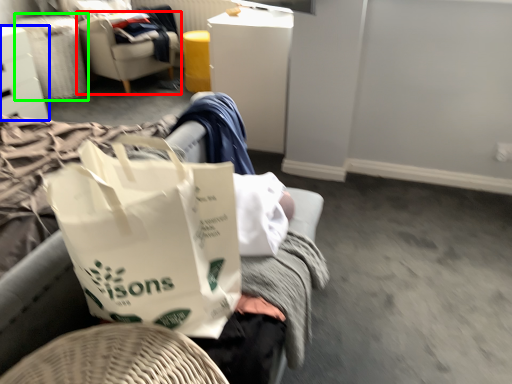
Question: Which object is the farthest from chair (highlighted by a red box)? Choose among these: furniture (highlighted by a blue box) or laundry basket (highlighted by a green box).

Choices:
 (A) furniture
 (B) laundry basket

Answer: (A)